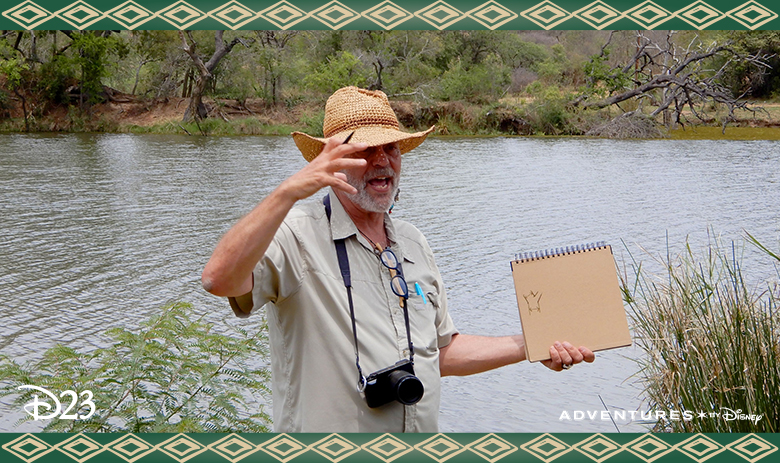
Identify the location of pen. (419, 295).